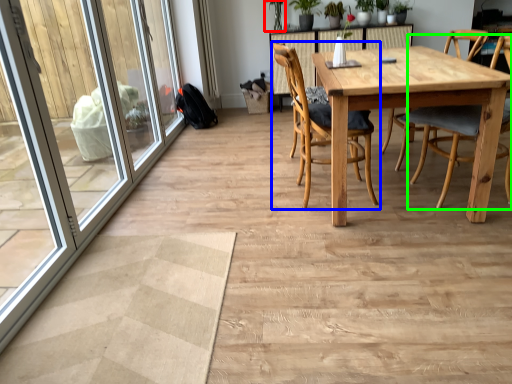
Question: Which is nearer to the plant (highlighted by a red box)? chair (highlighted by a blue box) or chair (highlighted by a green box).

Choices:
 (A) chair
 (B) chair

Answer: (A)